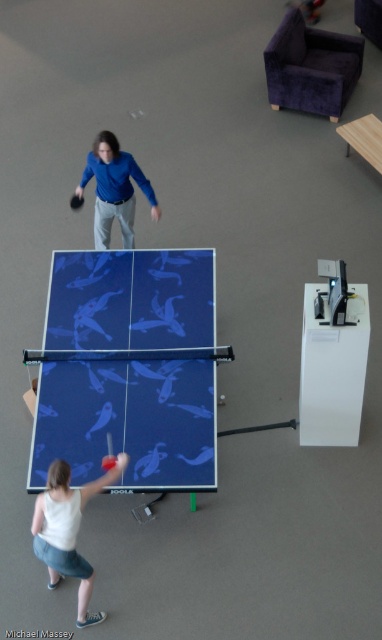
Question: Which point is closer to the camera?

Choices:
 (A) pos(90,168)
 (B) pos(79,202)
 (C) pos(147,268)

Answer: (C)

Question: Which of the following is the farthest from the observer?

Choices:
 (A) matte blue shirt at upper center
 (B) red rubber table tennis racket at lower left

Answer: (A)

Question: Can you confirm if blue rubber table tennis table at center is thinner than red rubber table tennis racket at lower left?

Choices:
 (A) yes
 (B) no

Answer: (B)

Question: Which object appears closest to the camera in this image?

Choices:
 (A) matte blue shirt at upper center
 (B) black rubber paddle at upper left

Answer: (A)

Question: Observing the image, what is the correct spatial positioning of matte blue shirt at upper center in reference to black rubber paddle at upper left?

Choices:
 (A) below
 (B) above

Answer: (B)

Question: Does blue rubber table tennis table at center lie in front of matte blue shirt at upper center?

Choices:
 (A) no
 (B) yes

Answer: (B)